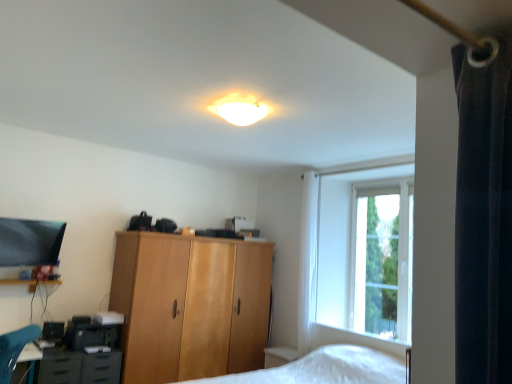
Question: Do you think wooden cabinet at center is within matte black drawer at lower left, or outside of it?

Choices:
 (A) inside
 (B) outside

Answer: (B)

Question: Is wooden cabinet at center wider or thinner than matte black drawer at lower left?

Choices:
 (A) thin
 (B) wide

Answer: (B)

Question: Which object is the farthest from the white fabric curtain at center?

Choices:
 (A) matte white ceiling light at upper center
 (B) clear glass window at upper right
 (C) matte black drawer at lower left
 (D) matte brown cabinet at lower left
 (E) wooden cabinet at center

Answer: (C)

Question: Estimate the real-world distances between objects in this image. Which object is closer to the white fabric curtain at center?

Choices:
 (A) wooden cabinet at center
 (B) clear glass window at upper right
 (C) matte black drawer at lower left
 (D) matte white ceiling light at upper center
 (E) matte brown cabinet at lower left

Answer: (B)